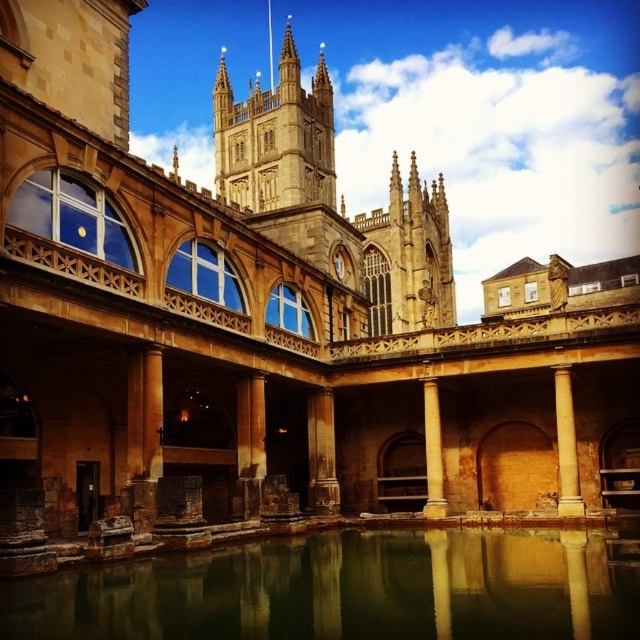
Who is higher up, greenish stone water at center or brown stone column at center?

brown stone column at center is higher up.

Is greenish stone water at center closer to camera compared to brown stone column at center?

Yes, it is in front of brown stone column at center.

Where is `greenish stone water at center`? The height and width of the screenshot is (640, 640). greenish stone water at center is located at coordinates (348, 589).

What are the coordinates of `greenish stone water at center` in the screenshot? It's located at (348, 589).

Does greenish stone water at center appear on the right side of brown stone pillar at center?

Correct, you'll find greenish stone water at center to the right of brown stone pillar at center.

Where is `greenish stone water at center`? The width and height of the screenshot is (640, 640). greenish stone water at center is located at coordinates (348, 589).

Where is `greenish stone water at center`? greenish stone water at center is located at coordinates (348, 589).

From the picture: Is brown stone pillar at center positioned before beige stone column at center?

Yes, brown stone pillar at center is closer to the viewer.

Which is behind, point (244, 506) or point (564, 458)?

Point (564, 458)

At what (x,y) coordinates should I click in order to perform the action: click on brown stone pillar at center. Please return your answer as a coordinate pair (x, y). Looking at the image, I should click on (250, 444).